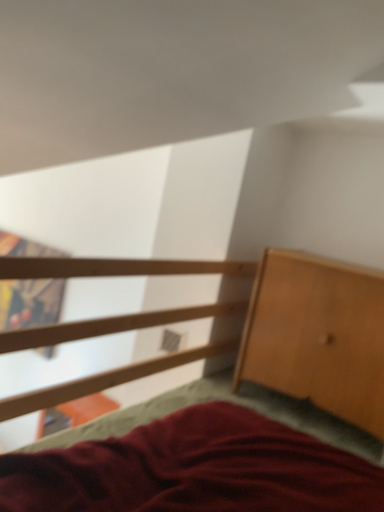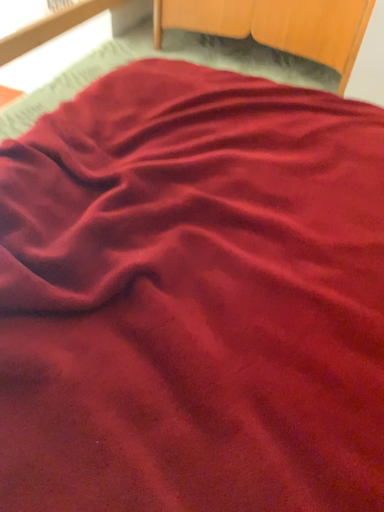
Question: How did the camera likely rotate when shooting the video?

Choices:
 (A) rotated downward
 (B) rotated upward

Answer: (A)